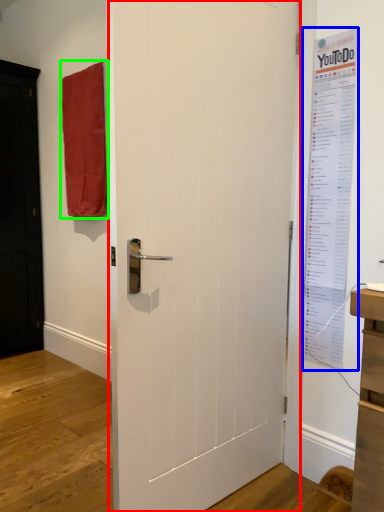
Question: Based on their relative distances, which object is farther from door (highlighted by a red box)? Choose from poster page (highlighted by a blue box) and curtain (highlighted by a green box).

Choices:
 (A) poster page
 (B) curtain

Answer: (B)